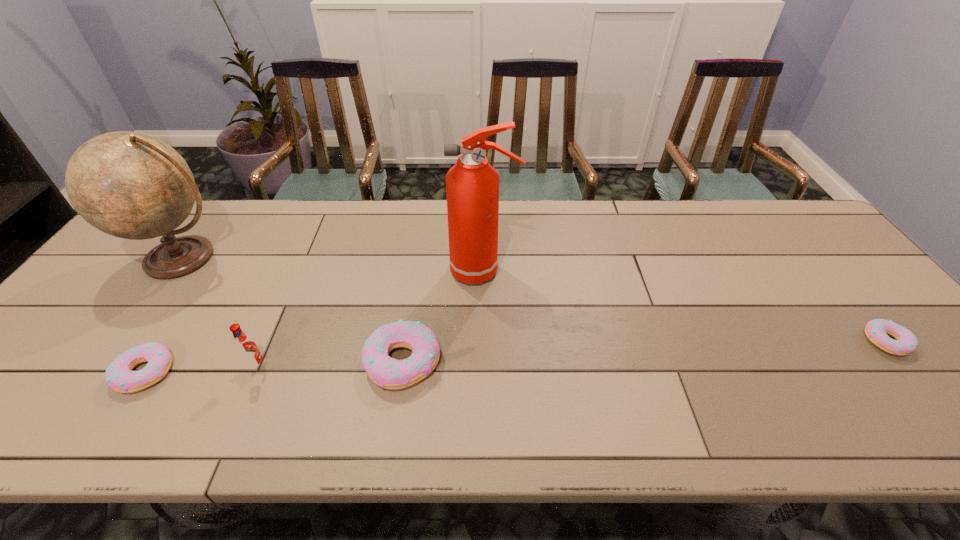
Image resolution: width=960 pixels, height=540 pixels. Find the location of `free location that satisfies the following two spatial constraints: 1. on the front-facing side of the shortest object; 2. on the left side of the globe`. free location that satisfies the following two spatial constraints: 1. on the front-facing side of the shortest object; 2. on the left side of the globe is located at coordinates (x=123, y=341).

Locate an element on the screen. The height and width of the screenshot is (540, 960). free space that satisfies the following two spatial constraints: 1. at the nozzle of the fifth object from left to right; 2. on the front side of the third object from right to left is located at coordinates (485, 362).

Find the location of a particular element. free space that satisfies the following two spatial constraints: 1. on the front-facing side of the shortest doughnut; 2. on the right side of the globe is located at coordinates (123, 341).

Where is `free spot that satisfies the following two spatial constraints: 1. on the front-facing side of the second doughnut from left to right; 2. on the left side of the globe`? The width and height of the screenshot is (960, 540). free spot that satisfies the following two spatial constraints: 1. on the front-facing side of the second doughnut from left to right; 2. on the left side of the globe is located at coordinates (108, 362).

Where is `vacant point that satisfies the following two spatial constraints: 1. on the front-facing side of the globe; 2. on the left side of the second shortest object`? The height and width of the screenshot is (540, 960). vacant point that satisfies the following two spatial constraints: 1. on the front-facing side of the globe; 2. on the left side of the second shortest object is located at coordinates [100, 373].